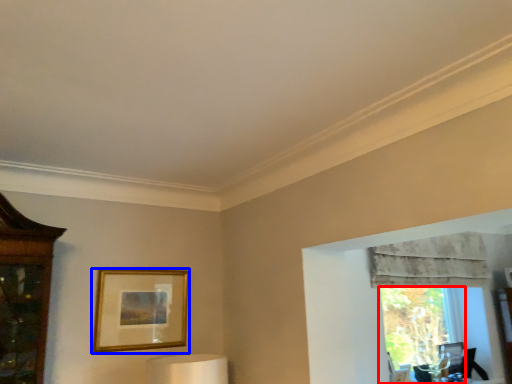
Question: Among these objects, which one is nearest to the camera, window (highlighted by a red box) or picture frame (highlighted by a blue box)?

Choices:
 (A) window
 (B) picture frame

Answer: (B)